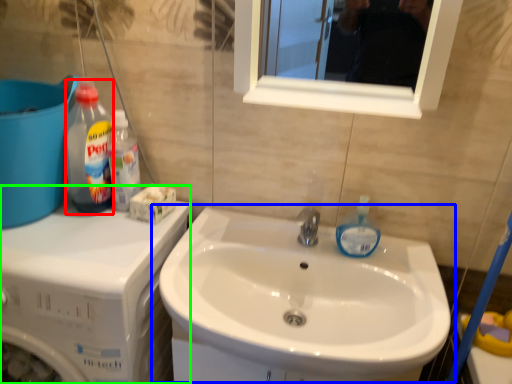
Question: Considering the real-world distances, which object is closest to cleaning product (highlighted by a red box)? sink (highlighted by a blue box) or dish washer (highlighted by a green box).

Choices:
 (A) sink
 (B) dish washer

Answer: (B)